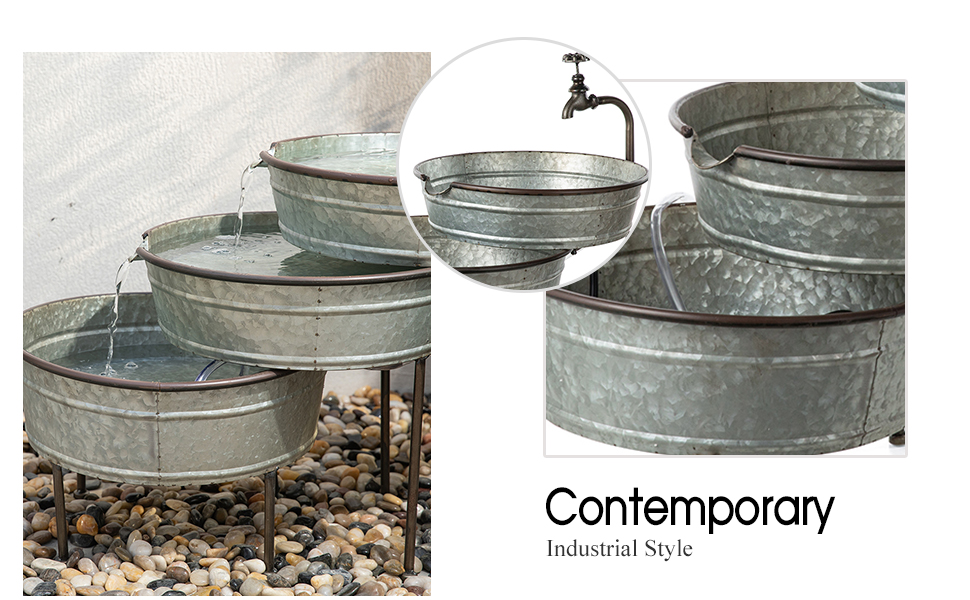
Image resolution: width=970 pixels, height=600 pixels. I want to click on white wall, so [x=156, y=108].